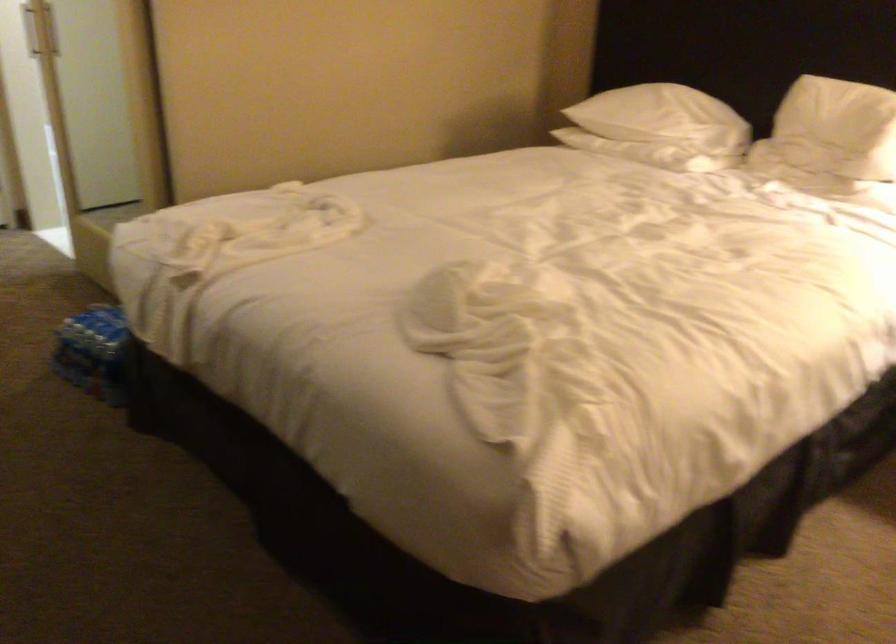
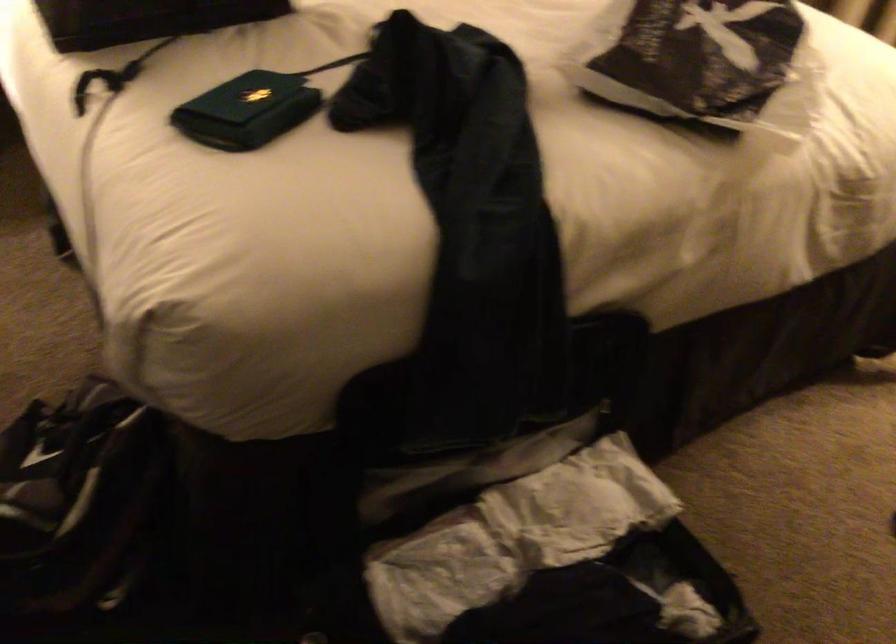
Based on the continuous images, in which direction is the camera rotating?

The camera rotated toward right-down.